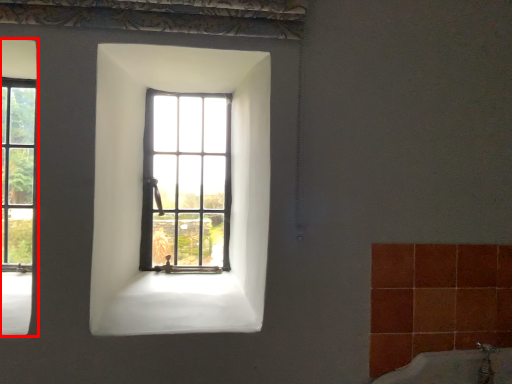
Question: From the image's perspective, considering the relative positions of window (annotated by the red box) and window in the image provided, where is window (annotated by the red box) located with respect to the staircase?

Choices:
 (A) below
 (B) above

Answer: (B)